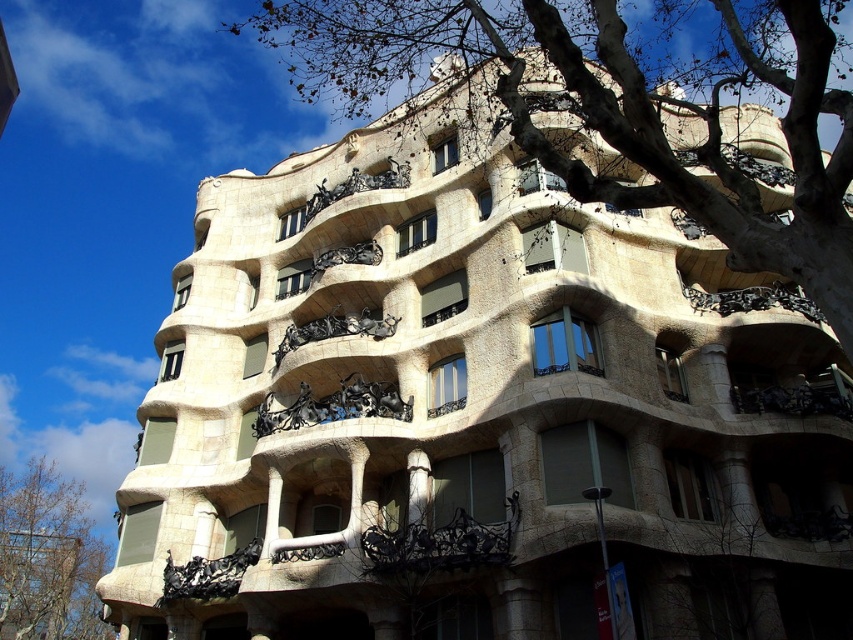
You are a drone operator planning to fly a drone from the brown leafy tree at lower left to the bare branches at upper center. The drone has a maximum flight range of 140 meters. Can it reach the destination without recharging?

The distance between the brown leafy tree at lower left and the bare branches at upper center is 140.64 meters, which exceeds the drone operator drone maximum flight range of 140 meters. Therefore, the drone cannot reach the destination without recharging.

Based on the photo, you are an architect analyzing the building. You notice the bare branches at upper center and the brown leafy tree at lower left. Which one is closer to the building facade?

The bare branches at upper center is in front of brown leafy tree at lower left, so it is closer to the building facade.